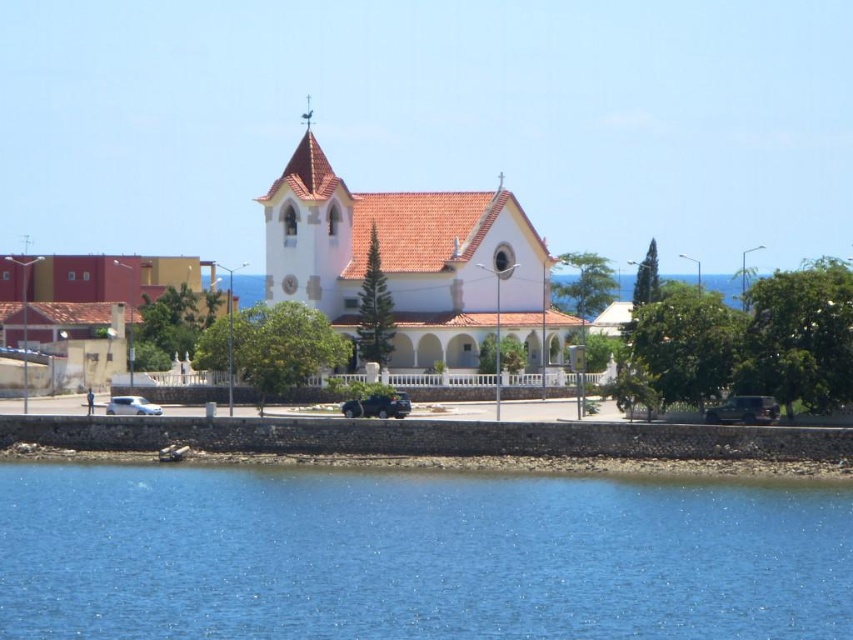
Question: Which object appears closest to the camera in this image?

Choices:
 (A) white stucco church at center
 (B) blue liquid water at lower center

Answer: (B)

Question: Is blue liquid water at lower center to the right of white stucco church at center from the viewer's perspective?

Choices:
 (A) no
 (B) yes

Answer: (B)

Question: Which of the following is the closest to the observer?

Choices:
 (A) white stucco church at center
 (B) blue liquid water at lower center

Answer: (B)

Question: Is blue liquid water at lower center positioned at the back of white stucco church at center?

Choices:
 (A) yes
 (B) no

Answer: (B)

Question: Does blue liquid water at lower center appear on the right side of white stucco church at center?

Choices:
 (A) no
 (B) yes

Answer: (B)

Question: Which point appears farthest from the camera in this image?

Choices:
 (A) (653, 497)
 (B) (312, 225)

Answer: (B)